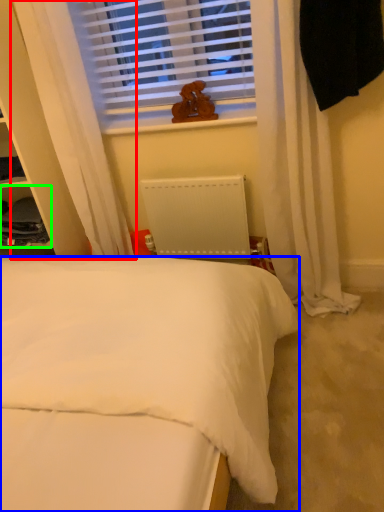
Question: Which object is positioned closest to curtain (highlighted by a red box)? Select from bed (highlighted by a blue box) and cabinet (highlighted by a green box).

Choices:
 (A) bed
 (B) cabinet

Answer: (B)